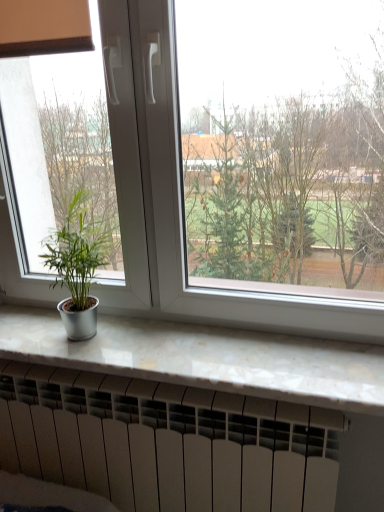
Question: From a real-world perspective, is white marble counter top at lower center located higher than white matte heater at bottom?

Choices:
 (A) no
 (B) yes

Answer: (B)

Question: From the image's perspective, is white marble counter top at lower center beneath white matte heater at bottom?

Choices:
 (A) yes
 (B) no

Answer: (B)

Question: Is white marble counter top at lower center at the right side of white matte heater at bottom?

Choices:
 (A) no
 (B) yes

Answer: (B)

Question: From a real-world perspective, is white marble counter top at lower center located beneath white matte heater at bottom?

Choices:
 (A) yes
 (B) no

Answer: (B)

Question: Can you confirm if white marble counter top at lower center is smaller than white matte heater at bottom?

Choices:
 (A) no
 (B) yes

Answer: (B)

Question: Is white marble counter top at lower center placed right next to white matte heater at bottom?

Choices:
 (A) no
 (B) yes

Answer: (A)

Question: Does white plastic window at center lie in front of green matte plant at left?

Choices:
 (A) no
 (B) yes

Answer: (B)

Question: Is white plastic window at center far from green matte plant at left?

Choices:
 (A) no
 (B) yes

Answer: (A)

Question: Does white plastic window at center have a greater height compared to green matte plant at left?

Choices:
 (A) no
 (B) yes

Answer: (B)

Question: Is white plastic window at center aimed at green matte plant at left?

Choices:
 (A) no
 (B) yes

Answer: (B)

Question: Considering the relative positions of white plastic window at center and green matte plant at left in the image provided, is white plastic window at center to the right of green matte plant at left from the viewer's perspective?

Choices:
 (A) no
 (B) yes

Answer: (B)

Question: Is white plastic window at center oriented away from green matte plant at left?

Choices:
 (A) yes
 (B) no

Answer: (A)

Question: Is white marble counter top at lower center not inside green matte plant at left?

Choices:
 (A) no
 (B) yes

Answer: (B)